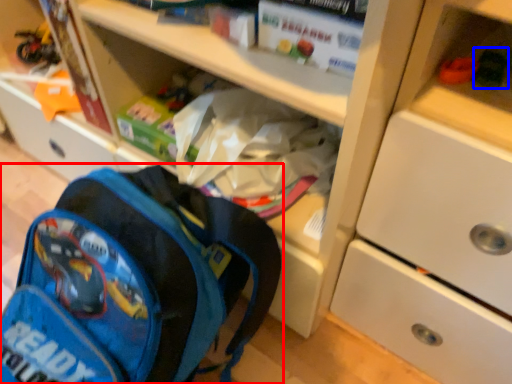
Question: Which object appears closest to the camera in this image, backpack (highlighted by a red box) or toy (highlighted by a blue box)?

Choices:
 (A) backpack
 (B) toy

Answer: (A)